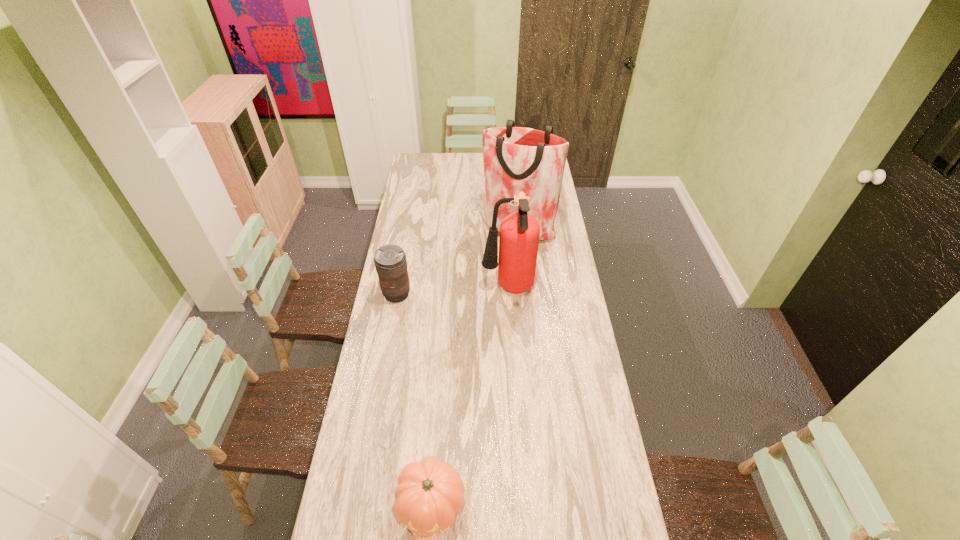
Identify the location of free spot that satisfies the following two spatial constraints: 1. at the nozzle of the fire extinguisher; 2. on the side of the third tallest object where the control switches are located. Image resolution: width=960 pixels, height=540 pixels. click(508, 294).